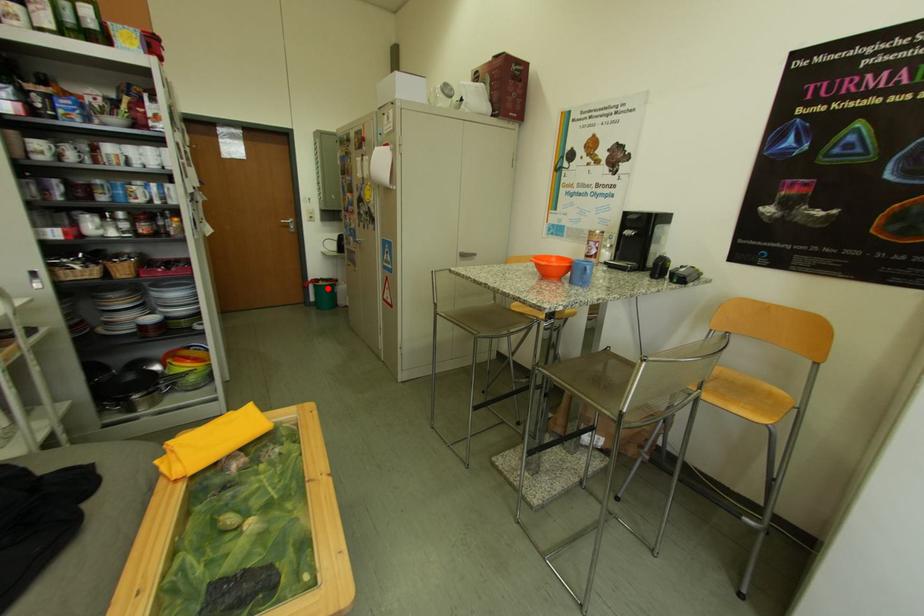
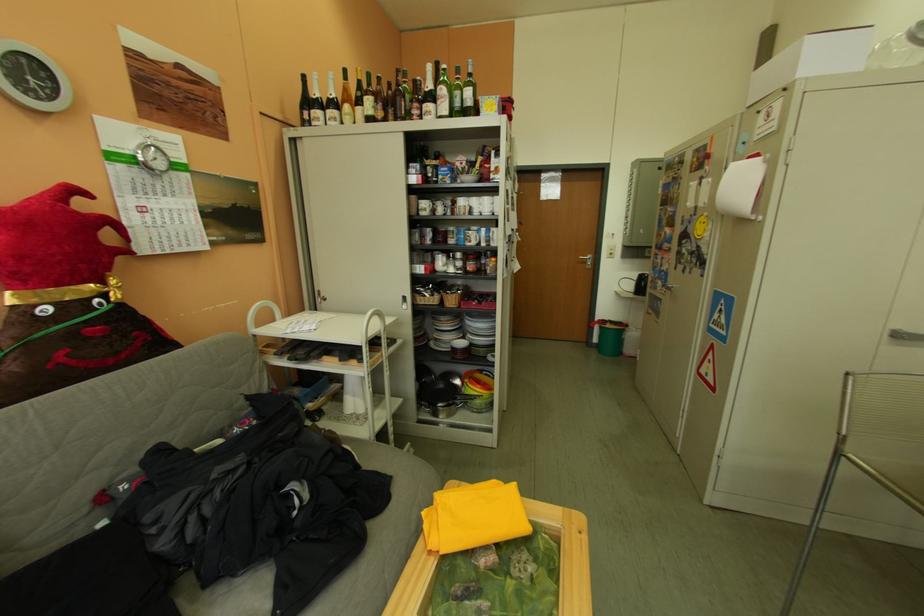
The point at the highlighted location is marked in the first image. Where is the corresponding point in the second image?

(613, 330)